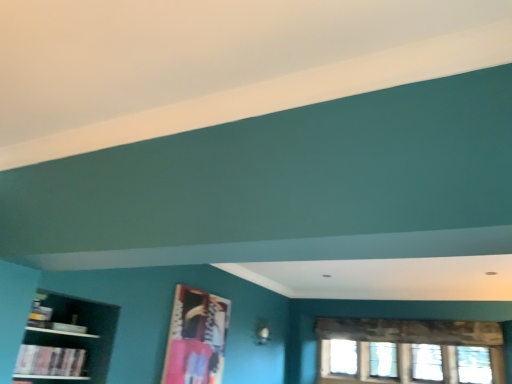
Where is `free location above metallic silver picture frame at center (from a real-world perspective)`? This screenshot has width=512, height=384. free location above metallic silver picture frame at center (from a real-world perspective) is located at coordinates 202,293.